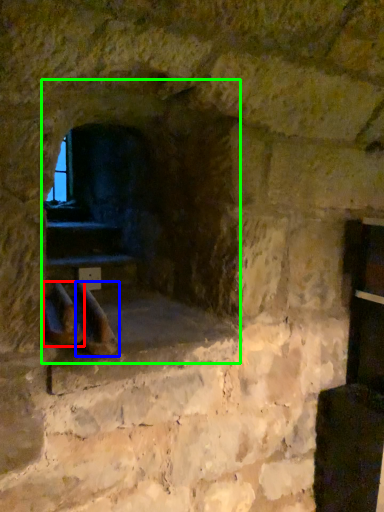
Question: Based on their relative distances, which object is nearer to footwear (highlighted by a red box)? Choose from footwear (highlighted by a blue box) and fireplace (highlighted by a green box).

Choices:
 (A) footwear
 (B) fireplace

Answer: (A)